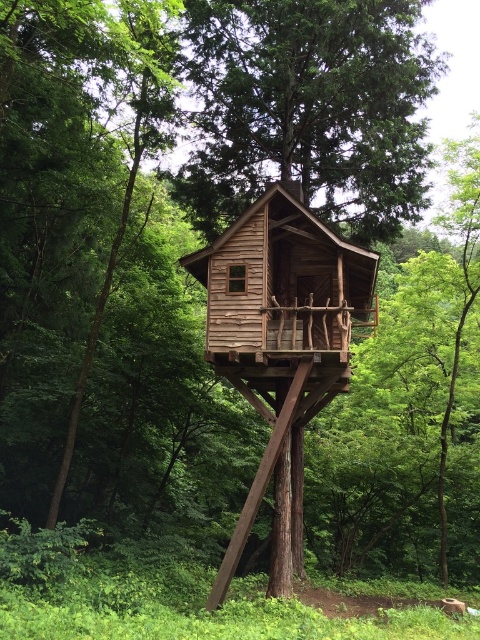
Does brown wooden house at center appear on the right side of wooden cabin at center?

Correct, you'll find brown wooden house at center to the right of wooden cabin at center.

Who is lower down, brown wooden house at center or wooden cabin at center?

wooden cabin at center is lower down.

Is point (272, 20) farther from viewer compared to point (241, 230)?

Yes.

Identify the location of brown wooden house at center. This screenshot has height=640, width=480. (309, 108).

Can you confirm if brown wooden cabin at center is smaller than brown wooden house at center?

Indeed, brown wooden cabin at center has a smaller size compared to brown wooden house at center.

Is brown wooden cabin at center to the left of brown wooden house at center from the viewer's perspective?

Indeed, brown wooden cabin at center is positioned on the left side of brown wooden house at center.

Measure the distance between point (60, 308) and camera.

Point (60, 308) and camera are 16.50 meters apart.

Locate an element on the screen. brown wooden cabin at center is located at coordinates (72, 168).

At what (x,y) coordinates should I click in order to perform the action: click on brown wooden cabin at center. Please return your answer as a coordinate pair (x, y). This screenshot has height=640, width=480. Looking at the image, I should click on (72, 168).

Between point (110, 131) and point (348, 304), which one is positioned behind?

The point (110, 131) is behind.

Who is more forward, (103, 40) or (290, 211)?

Point (103, 40) is more forward.

This screenshot has height=640, width=480. In order to click on brown wooden cabin at center in this screenshot , I will do pyautogui.click(x=72, y=168).